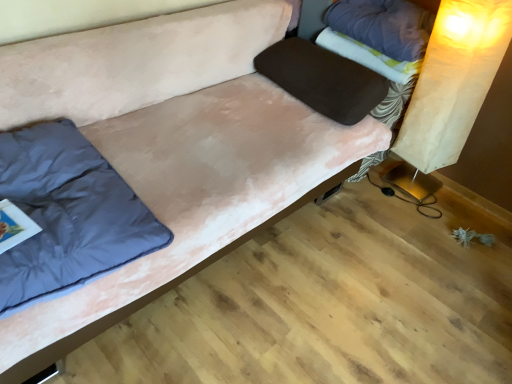
In order to click on vacant area that is in front of matte paper lampshade at right in this screenshot , I will do `click(413, 214)`.